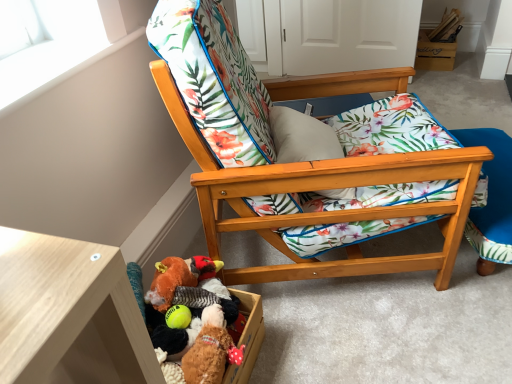
Question: From the image's perspective, is fluffy brown teddy bear at lower center, the 1th toy viewed from the front, located above wooden folding chair at lower right?

Choices:
 (A) no
 (B) yes

Answer: (A)

Question: Is fluffy brown teddy bear at lower center, the 1th toy viewed from the front, thinner than wooden folding chair at lower right?

Choices:
 (A) no
 (B) yes

Answer: (B)

Question: From the image's perspective, is fluffy brown teddy bear at lower center, the 1th toy viewed from the front, beneath wooden folding chair at lower right?

Choices:
 (A) yes
 (B) no

Answer: (A)

Question: From a real-world perspective, is fluffy brown teddy bear at lower center, the 1th toy viewed from the front, located beneath wooden folding chair at lower right?

Choices:
 (A) yes
 (B) no

Answer: (B)

Question: Is fluffy brown teddy bear at lower center, the 2th toy from the back, facing towards wooden folding chair at lower right?

Choices:
 (A) yes
 (B) no

Answer: (B)

Question: Is wooden folding chair at lower right inside fluffy brown teddy bear at lower center, the 1th toy viewed from the front?

Choices:
 (A) no
 (B) yes

Answer: (A)

Question: Can you confirm if wooden box at upper right is smaller than wooden folding chair at lower right?

Choices:
 (A) yes
 (B) no

Answer: (A)

Question: From a real-world perspective, is wooden box at upper right over wooden folding chair at lower right?

Choices:
 (A) yes
 (B) no

Answer: (B)

Question: Is wooden box at upper right taller than wooden folding chair at lower right?

Choices:
 (A) no
 (B) yes

Answer: (A)

Question: Can you confirm if wooden box at upper right is bigger than wooden folding chair at lower right?

Choices:
 (A) yes
 (B) no

Answer: (B)

Question: Is wooden box at upper right aimed at wooden folding chair at lower right?

Choices:
 (A) no
 (B) yes

Answer: (B)

Question: From a real-world perspective, is wooden box at upper right positioned under wooden folding chair at lower right based on gravity?

Choices:
 (A) yes
 (B) no

Answer: (A)

Question: Does wooden chair with floral cushion at center have a smaller size compared to white matte window screen at upper left?

Choices:
 (A) no
 (B) yes

Answer: (A)